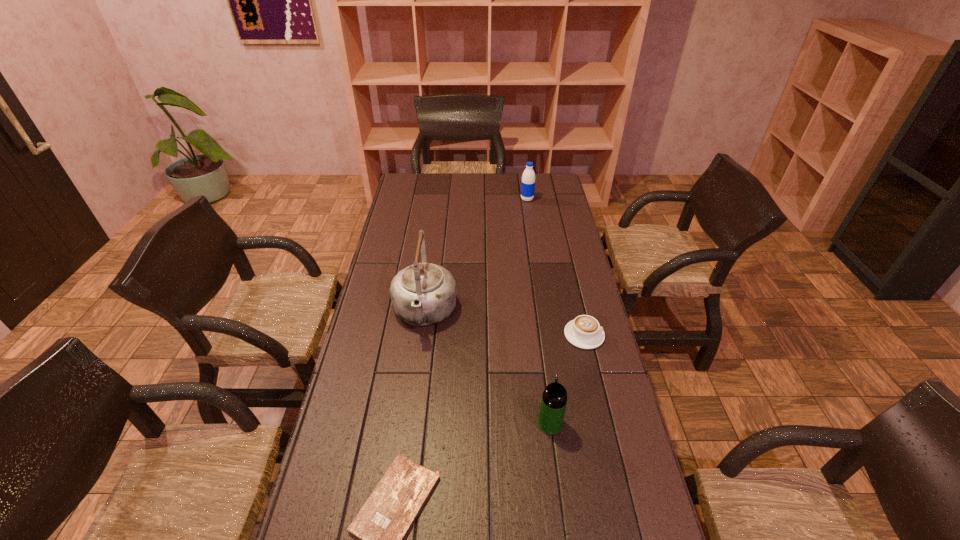
Where is `free space between the rightmost object and the farthest object`? The width and height of the screenshot is (960, 540). free space between the rightmost object and the farthest object is located at coordinates (556, 267).

Where is `empty location between the rightmost object and the fourth farthest object`? This screenshot has width=960, height=540. empty location between the rightmost object and the fourth farthest object is located at coordinates (567, 379).

Where is `free area in between the tallest object and the water bottle`? free area in between the tallest object and the water bottle is located at coordinates (476, 256).

Where is `empty location between the kettle and the second nearest object`? The height and width of the screenshot is (540, 960). empty location between the kettle and the second nearest object is located at coordinates (488, 368).

Locate an element on the screen. The width and height of the screenshot is (960, 540). empty space that is in between the kettle and the second shortest object is located at coordinates (504, 324).

Find the location of a particular element. This screenshot has width=960, height=540. empty space that is in between the thermos bottle and the kettle is located at coordinates (488, 368).

Identify the location of the closest object relative to the second shortest object. The width and height of the screenshot is (960, 540). (554, 398).

Where is `the second closest object to the second nearest object`? the second closest object to the second nearest object is located at coordinates (383, 522).